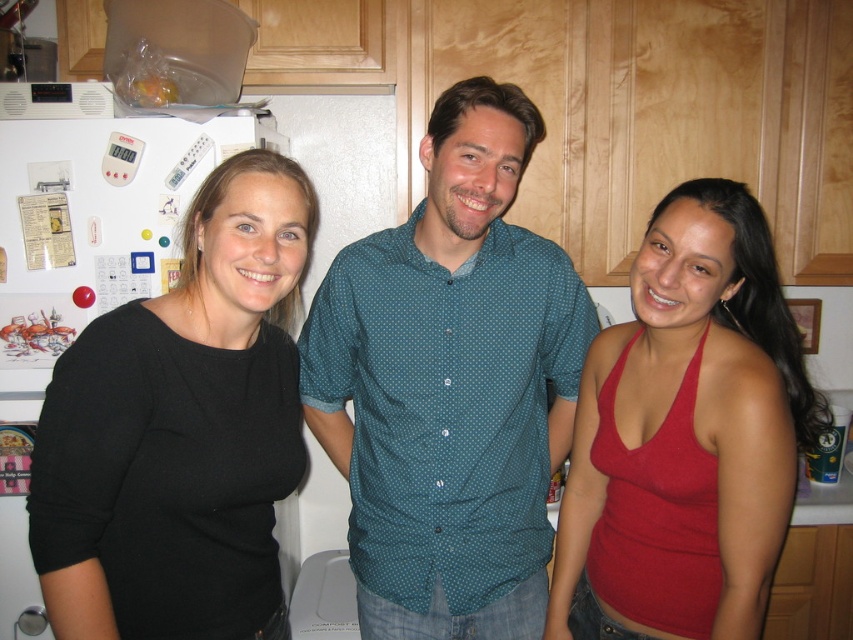
Based on the photo, does teal dotted shirt at center appear under black matte shirt at left?

Actually, teal dotted shirt at center is above black matte shirt at left.

Which of these two, teal dotted shirt at center or black matte shirt at left, stands taller?

With more height is teal dotted shirt at center.

The width and height of the screenshot is (853, 640). Describe the element at coordinates (450, 385) in the screenshot. I see `teal dotted shirt at center` at that location.

Identify the location of teal dotted shirt at center. (450, 385).

Can you confirm if teal dotted shirt at center is thinner than matte red tank top at center?

No.

Does teal dotted shirt at center appear on the left side of matte red tank top at center?

Correct, you'll find teal dotted shirt at center to the left of matte red tank top at center.

Which is behind, point (498, 310) or point (572, 556)?

The point (572, 556) is more distant.

Find the location of `teal dotted shirt at center`. teal dotted shirt at center is located at coordinates (450, 385).

Consider the image. Is black matte shirt at left to the right of matte red tank top at center from the viewer's perspective?

In fact, black matte shirt at left is to the left of matte red tank top at center.

Between black matte shirt at left and matte red tank top at center, which one has less height?

With less height is black matte shirt at left.

Describe the element at coordinates (181, 429) in the screenshot. I see `black matte shirt at left` at that location.

Identify the location of black matte shirt at left. (181, 429).